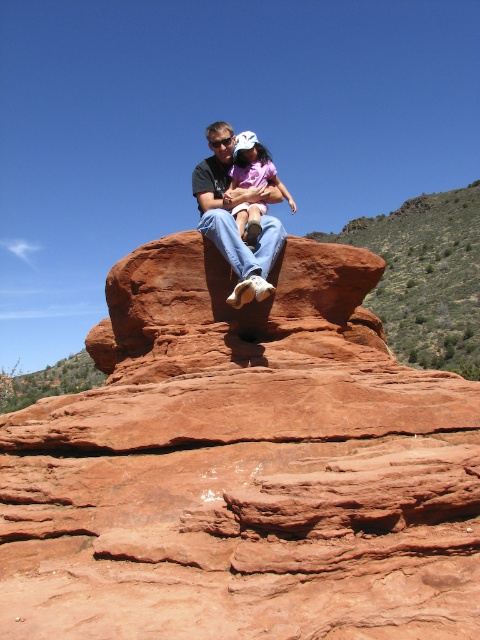
Who is positioned more to the right, reddish-brown sandstone at upper center or matte black shirt at center?

From the viewer's perspective, reddish-brown sandstone at upper center appears more on the right side.

Does point (328, 400) lie behind point (218, 243)?

No, (328, 400) is in front of (218, 243).

You are a GUI agent. You are given a task and a screenshot of the screen. Output one action in this format:
    pyautogui.click(x=<x>, y=<y>)
    Task: Click on the reddish-brown sandstone at upper center
    
    Given the screenshot: What is the action you would take?
    pyautogui.click(x=242, y=467)

Is matte black shirt at center wider than matte pink shirt at center?

Indeed, matte black shirt at center has a greater width compared to matte pink shirt at center.

Does matte black shirt at center appear over matte pink shirt at center?

Yes.

Is point (229, 227) behind point (240, 211)?

No, it is not.

I want to click on matte black shirt at center, so click(233, 218).

Who is higher up, reddish-brown sandstone at upper center or matte pink shirt at center?

matte pink shirt at center is higher up.

Which of these two, reddish-brown sandstone at upper center or matte pink shirt at center, stands taller?

Standing taller between the two is reddish-brown sandstone at upper center.

Does point (397, 500) come closer to viewer compared to point (237, 140)?

Yes, it is in front of point (237, 140).

Where is `reddish-brown sandstone at upper center`? The image size is (480, 640). reddish-brown sandstone at upper center is located at coordinates (242, 467).